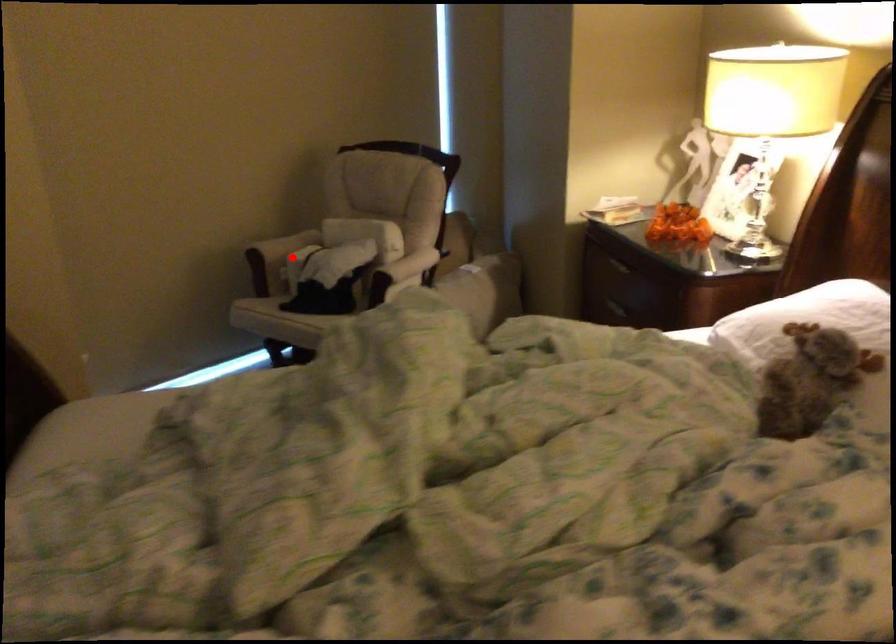
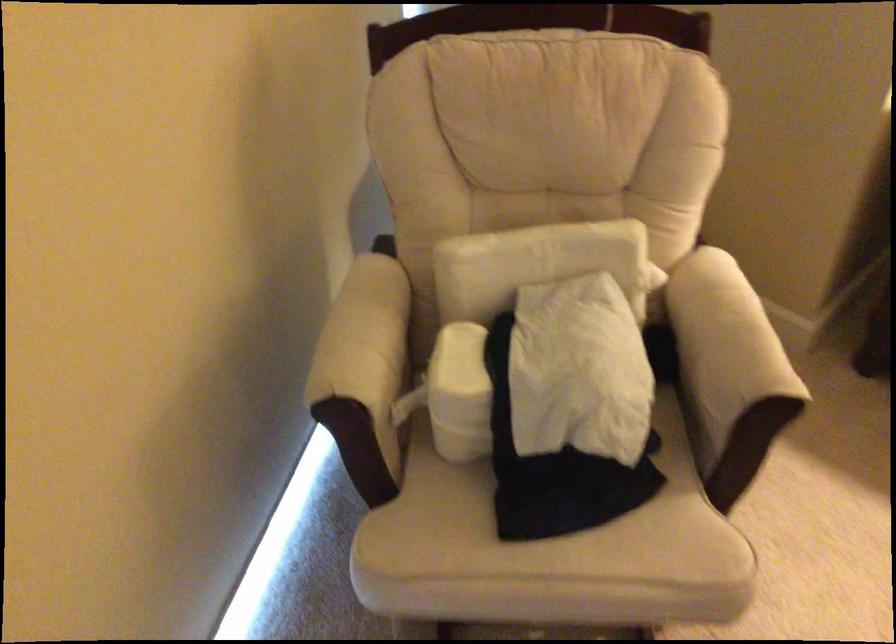
Find the pixel in the second image that matches the highlighted location in the first image.

(460, 393)